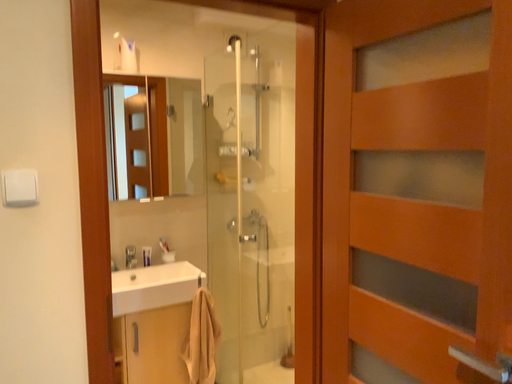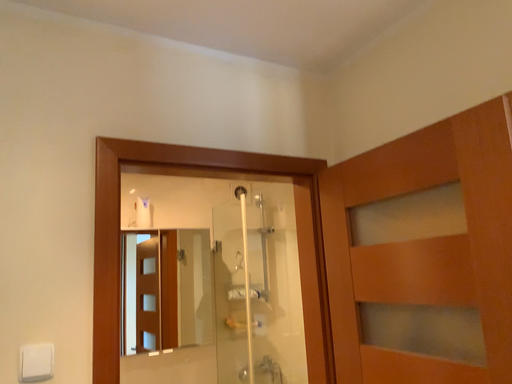
Question: How did the camera likely rotate when shooting the video?

Choices:
 (A) rotated upward
 (B) rotated downward

Answer: (A)